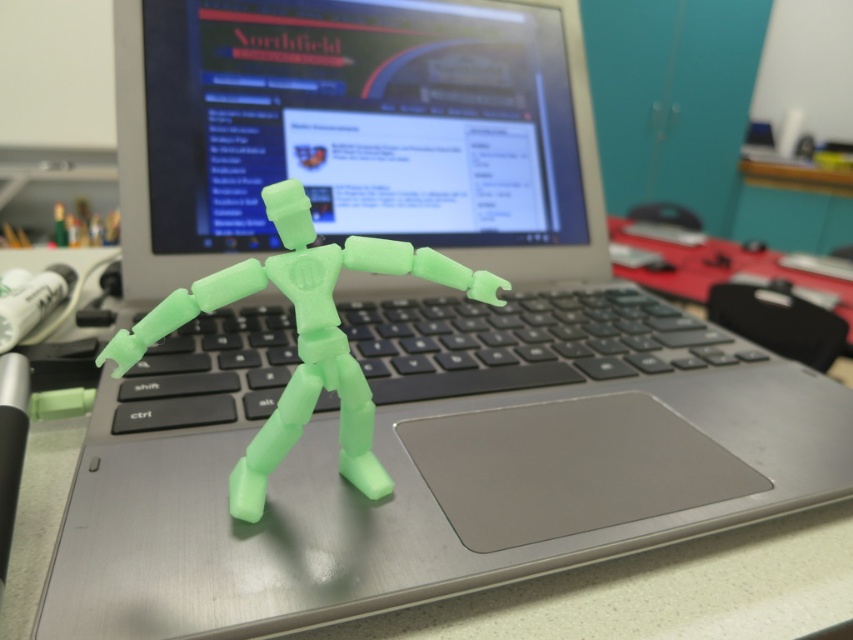
You are organizing your desk and need to place a new item between the matte plastic monitor at center and the black plastic keyboard at center. Which object should you place the item closer to if you want it to be near the larger object?

The matte plastic monitor at center is larger than the black plastic keyboard at center, so you should place the item closer to the matte plastic monitor at center.

You are organizing your desk and need to place a small figurine between the matte plastic monitor at center and the black plastic keyboard at center. According to their positions, which object should the figurine be closer to?

The matte plastic monitor at center is to the left of the black plastic keyboard at center, so the figurine is already positioned on the keyboard. To place it between them, it should be closer to the matte plastic monitor at center since it is on the left side.

You are organizing items on a desk and want to place a small toy on the translucent green plastic figure at center. However, you notice the black plastic keyboard at center is in the way. Can you move the keyboard to make space?

The black plastic keyboard at center is further to the viewer than the translucent green plastic figure at center, so moving the keyboard would allow access to the translucent green plastic figure at center.